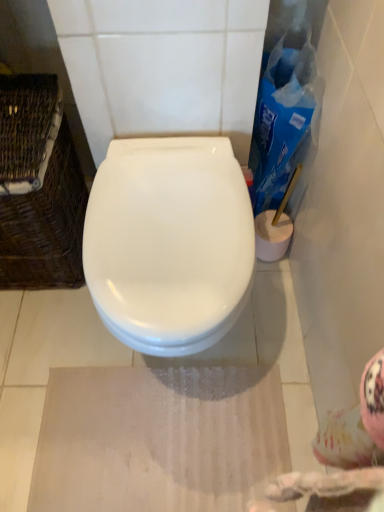
The width and height of the screenshot is (384, 512). I want to click on free space above white glossy toilet at center (from a real-world perspective), so click(170, 202).